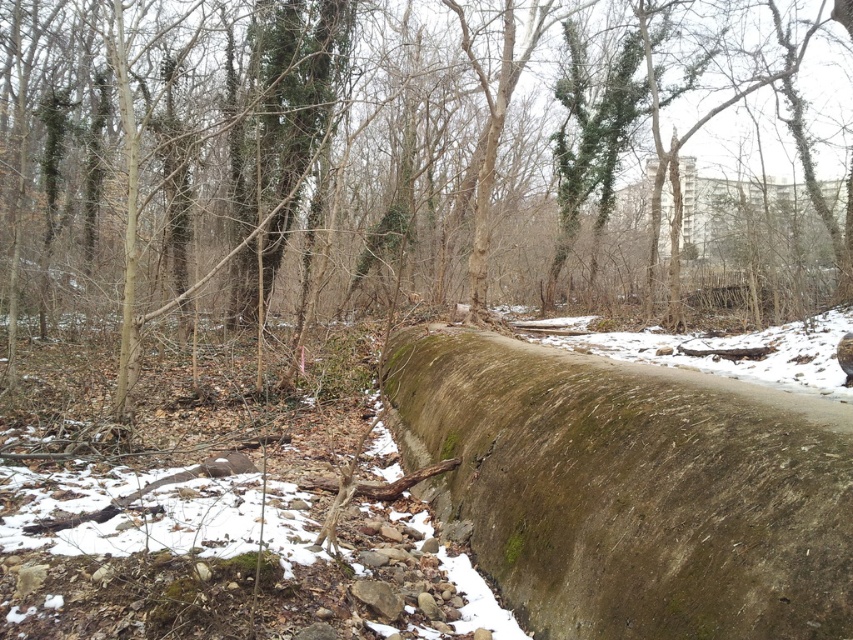
Question: Can you confirm if green mossy wall at center is thinner than green mossy concrete log at center?

Choices:
 (A) no
 (B) yes

Answer: (A)

Question: Where is green mossy wall at center located in relation to green mossy concrete log at center in the image?

Choices:
 (A) left
 (B) right

Answer: (B)

Question: Which point appears farthest from the camera in this image?

Choices:
 (A) click(720, 294)
 (B) click(415, 387)

Answer: (A)

Question: Is green mossy wall at center to the left of green mossy concrete log at center from the viewer's perspective?

Choices:
 (A) no
 (B) yes

Answer: (A)

Question: Which of the following is the closest to the observer?

Choices:
 (A) (518, 394)
 (B) (85, 108)

Answer: (A)